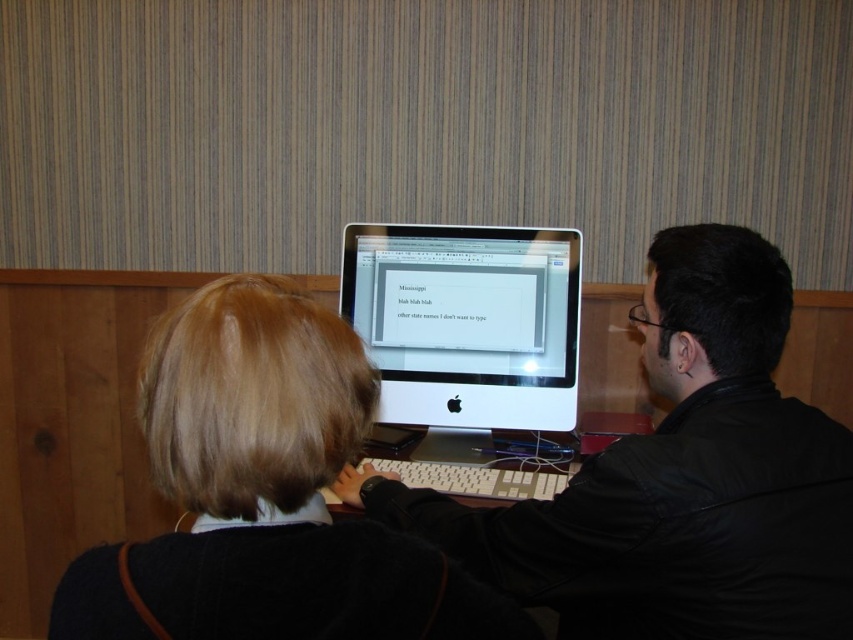
In the scene shown: You are a photographer taking a picture of the scene. You notice the matte black sweater at center and the white glossy computer monitor at center. Which object is closer to the camera lens?

The matte black sweater at center is closer to the camera lens because it is shorter than the white glossy computer monitor at center.

You are organizing a small desk and need to place a matte black computer at center and a matte black sweater at center. Based on their sizes, which one should you place first to ensure they both fit on the desk?

The matte black computer at center is wider than the matte black sweater at center. Therefore, you should place the matte black computer at center first to ensure there is enough space for both items on the desk.